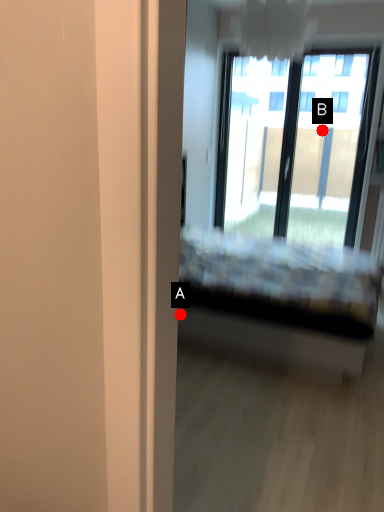
Question: Two points are circled on the image, labeled by A and B beside each circle. Which point appears closest to the camera in this image?

Choices:
 (A) A is closer
 (B) B is closer

Answer: (A)